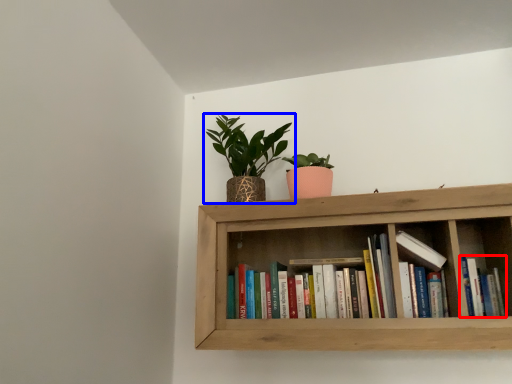
Question: Which object appears closest to the camera in this image, book (highlighted by a red box) or houseplant (highlighted by a blue box)?

Choices:
 (A) book
 (B) houseplant

Answer: (A)